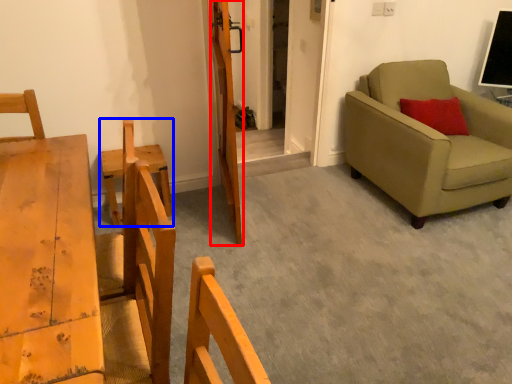
Question: Which object is further to the camera taking this photo, door (highlighted by a red box) or armchair (highlighted by a blue box)?

Choices:
 (A) door
 (B) armchair

Answer: (B)